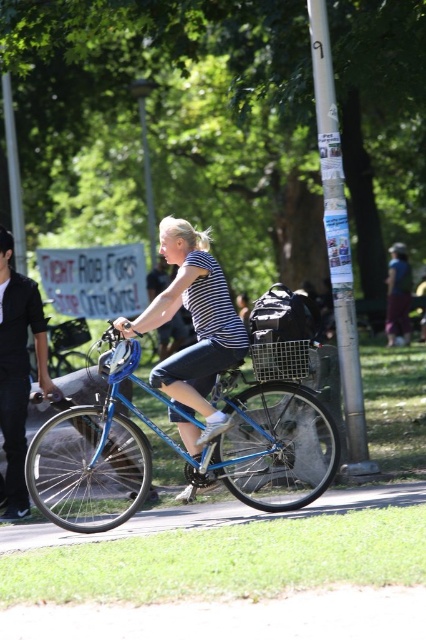
Question: Which object is the farthest from the dark blue jeans at center?

Choices:
 (A) matte blue helmet at center
 (B) striped fabric shirt at center
 (C) shiny blue bicycle at center

Answer: (A)

Question: Is black cotton shirt at left above matte blue helmet at center?

Choices:
 (A) no
 (B) yes

Answer: (A)

Question: Which of these objects is positioned farthest from the shiny blue bicycle at center?

Choices:
 (A) dark blue jeans at center
 (B) metallic wire basket at center

Answer: (A)

Question: Can you confirm if black cotton shirt at left is bigger than matte blue helmet at center?

Choices:
 (A) yes
 (B) no

Answer: (A)

Question: Which of the following is the closest to the observer?

Choices:
 (A) (219, 312)
 (B) (28, 285)

Answer: (A)

Question: Can you confirm if black cotton shirt at left is positioned below metallic wire basket at center?

Choices:
 (A) yes
 (B) no

Answer: (A)